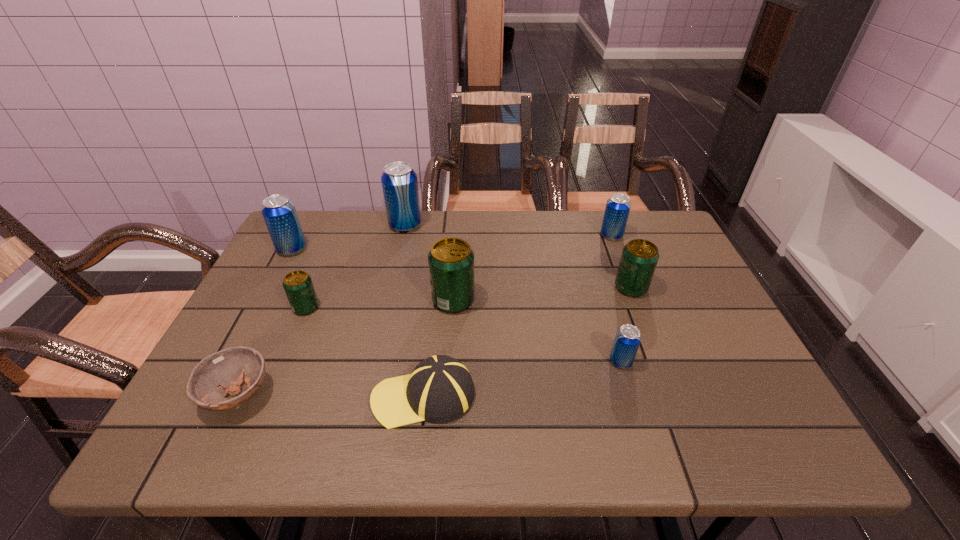
What are the coordinates of `vacant space located on the left of the third object from right to left` in the screenshot? It's located at (493, 361).

Where is `vacant region located 0.180m on the right of the leftmost green beer can`? The height and width of the screenshot is (540, 960). vacant region located 0.180m on the right of the leftmost green beer can is located at coordinates (390, 307).

In order to click on vacant region located 0.380m with the brim of the baseball cap facing forward in this screenshot , I will do `click(191, 396)`.

You are a GUI agent. You are given a task and a screenshot of the screen. Output one action in this format:
    pyautogui.click(x=<x>, y=<y>)
    Task: Click on the free space located with the brim of the baseball cap facing forward
    The image size is (960, 540).
    Given the screenshot: What is the action you would take?
    [196, 396]

The image size is (960, 540). I want to click on blank area located with the brim of the baseball cap facing forward, so click(339, 396).

Where is `baseball cap at the near edge`? The height and width of the screenshot is (540, 960). baseball cap at the near edge is located at coordinates (440, 388).

Where is `bowl present at the near edge`? The image size is (960, 540). bowl present at the near edge is located at coordinates (221, 373).

The width and height of the screenshot is (960, 540). Find the location of `bowl situated at the left edge`. bowl situated at the left edge is located at coordinates (221, 373).

Locate an element on the screen. object present at the far left corner is located at coordinates (279, 212).

Identify the location of object present at the near left corner. (221, 373).